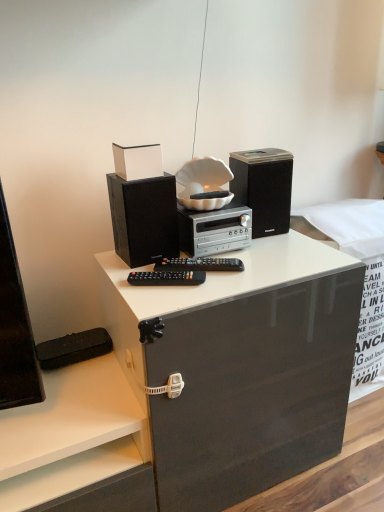
Question: Is white glossy box at upper center facing towards black matte speaker at upper right, the second speaker positioned from the left?

Choices:
 (A) no
 (B) yes

Answer: (A)

Question: From the image's perspective, is white glossy box at upper center located beneath black matte speaker at upper right, the second speaker positioned from the left?

Choices:
 (A) no
 (B) yes

Answer: (A)

Question: Is white glossy box at upper center oriented away from black matte speaker at upper right, arranged as the first speaker when viewed from the right?

Choices:
 (A) yes
 (B) no

Answer: (B)

Question: Does white glossy box at upper center appear on the right side of black matte speaker at upper right, arranged as the first speaker when viewed from the right?

Choices:
 (A) yes
 (B) no

Answer: (B)

Question: Considering the relative sizes of white glossy box at upper center and black matte speaker at upper right, arranged as the first speaker when viewed from the right, in the image provided, is white glossy box at upper center smaller than black matte speaker at upper right, arranged as the first speaker when viewed from the right,?

Choices:
 (A) yes
 (B) no

Answer: (A)

Question: Can you confirm if white glossy box at upper center is positioned to the left of black matte speaker at upper right, the second speaker positioned from the left?

Choices:
 (A) yes
 (B) no

Answer: (A)

Question: Is black matte speaker at left, the first speaker in the left-to-right sequence, looking in the opposite direction of black plastic remote control at center?

Choices:
 (A) no
 (B) yes

Answer: (A)

Question: Can you confirm if black matte speaker at left, the first speaker in the left-to-right sequence, is smaller than black plastic remote control at center?

Choices:
 (A) yes
 (B) no

Answer: (B)

Question: From a real-world perspective, is black matte speaker at left, which ranks as the 2th speaker in right-to-left order, positioned over black plastic remote control at center based on gravity?

Choices:
 (A) no
 (B) yes

Answer: (B)

Question: Is black matte speaker at left, the first speaker in the left-to-right sequence, in contact with black plastic remote control at center?

Choices:
 (A) no
 (B) yes

Answer: (A)

Question: Considering the relative sizes of black matte speaker at left, the first speaker in the left-to-right sequence, and black plastic remote control at center in the image provided, is black matte speaker at left, the first speaker in the left-to-right sequence, shorter than black plastic remote control at center?

Choices:
 (A) no
 (B) yes

Answer: (A)

Question: Is black matte speaker at left, the first speaker in the left-to-right sequence, outside of black plastic remote control at center?

Choices:
 (A) yes
 (B) no

Answer: (A)

Question: Does black plastic remote control at center have a greater height compared to black matte speaker at left, which ranks as the 2th speaker in right-to-left order?

Choices:
 (A) no
 (B) yes

Answer: (A)